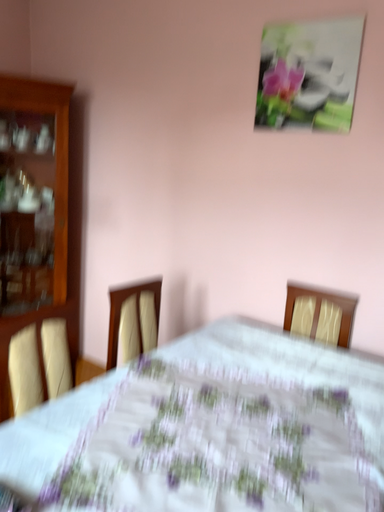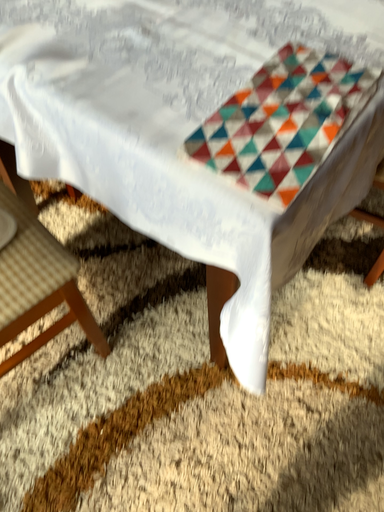
Question: How did the camera likely rotate when shooting the video?

Choices:
 (A) rotated downward
 (B) rotated upward

Answer: (A)